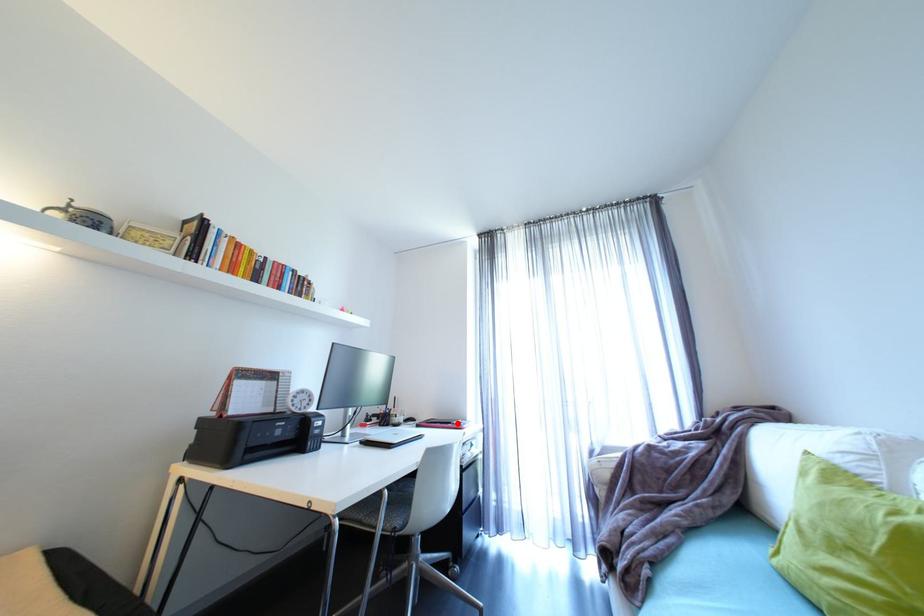
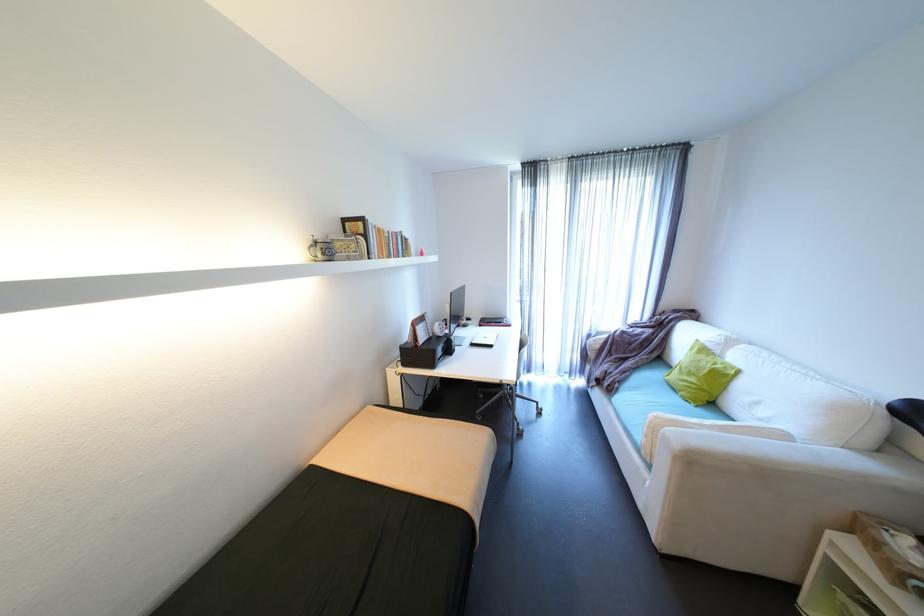
In the second image, find the point that corresponds to the highlighted location in the first image.

(508, 323)